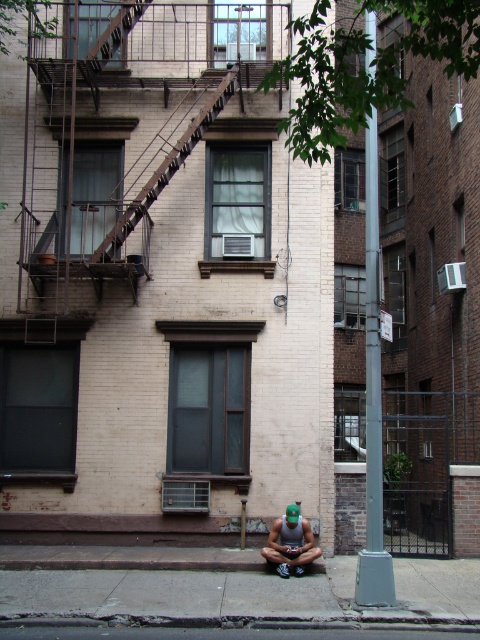
Question: Is gray concrete pavement at lower center below smooth concrete pavement at lower center?

Choices:
 (A) no
 (B) yes

Answer: (B)

Question: Is silver metallic pole at center to the left of smooth concrete pavement at lower center from the viewer's perspective?

Choices:
 (A) yes
 (B) no

Answer: (B)

Question: Does silver metallic pole at center have a larger size compared to green fabric squat at lower center?

Choices:
 (A) yes
 (B) no

Answer: (B)

Question: Which point appears closest to the camera in this image?

Choices:
 (A) (374, 356)
 (B) (278, 532)
 (C) (159, 616)

Answer: (C)

Question: Which object is the closest to the gray concrete pavement at lower center?

Choices:
 (A) green fabric squat at lower center
 (B) silver metallic pole at center

Answer: (A)

Question: Which object is farther from the camera taking this photo?

Choices:
 (A) green fabric squat at lower center
 (B) silver metallic pole at center
 (C) gray concrete pavement at lower center
 (D) smooth concrete pavement at lower center

Answer: (A)